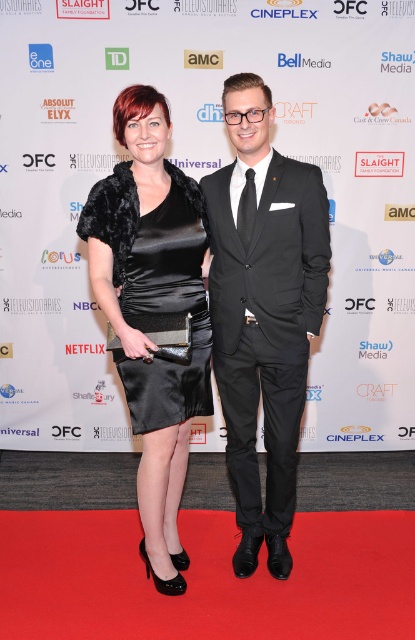
Which is more to the left, matte black suit at center or satin black dress at center?

satin black dress at center is more to the left.

Is point (248, 266) positioned in front of point (188, 310)?

That is True.

You are a GUI agent. You are given a task and a screenshot of the screen. Output one action in this format:
    pyautogui.click(x=<x>, y=<y>)
    Task: Click on the matte black suit at center
    This screenshot has width=415, height=640.
    Given the screenshot: What is the action you would take?
    pyautogui.click(x=263, y=310)